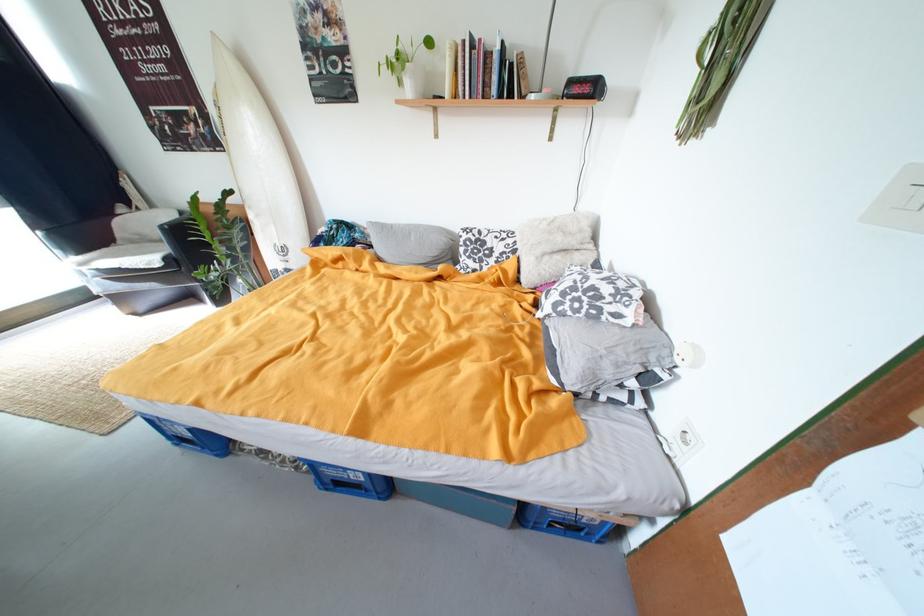
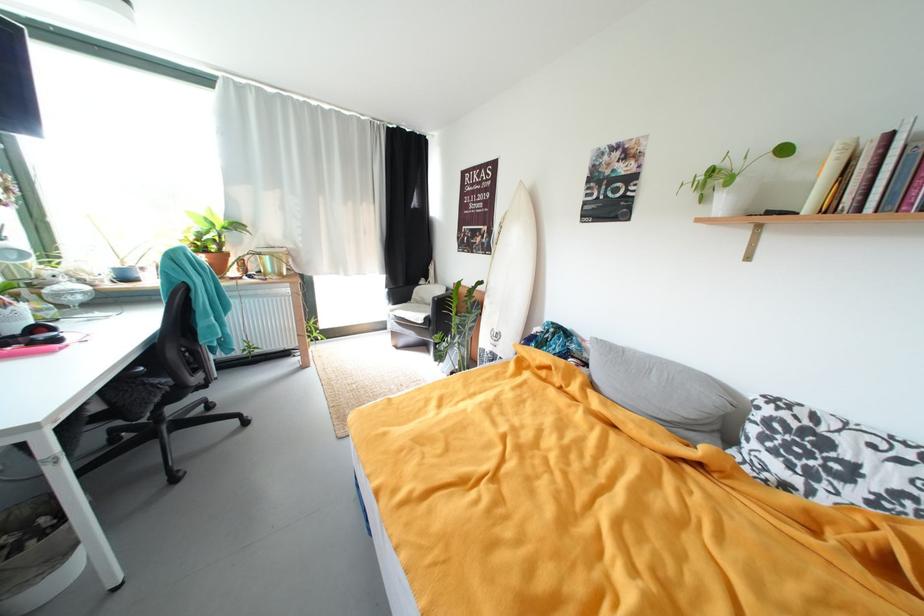
Find the pixel in the second image that matches [456,95] in the first image.

(817, 209)